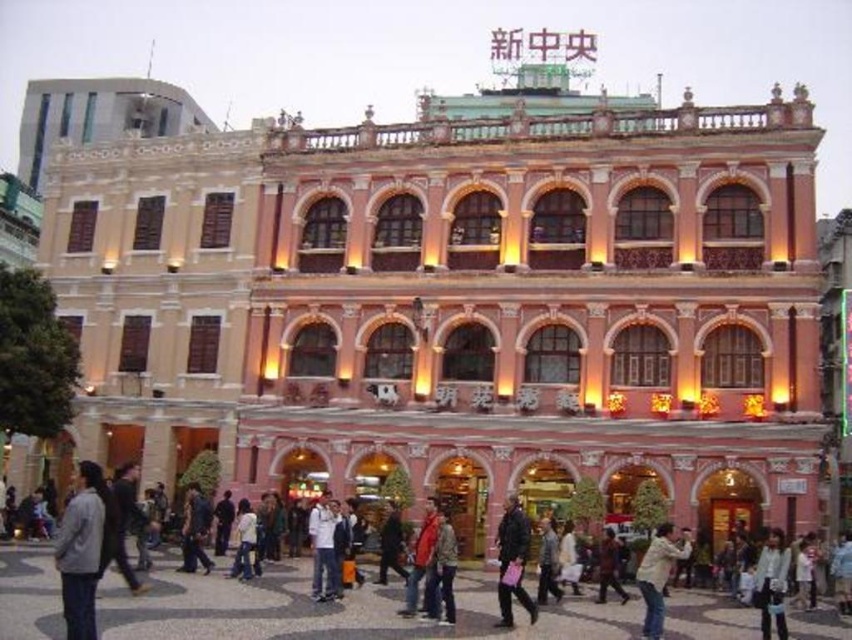
Which is more to the left, dark blue leather jacket at center or brown leather jacket at center?

dark blue leather jacket at center

Does point (531, 614) come farther from viewer compared to point (603, 541)?

No, (531, 614) is in front of (603, 541).

Measure the distance between point (501,554) and camera.

Point (501,554) and camera are 44.06 meters apart from each other.

At what (x,y) coordinates should I click in order to perform the action: click on dark blue leather jacket at center. Please return your answer as a coordinate pair (x, y). Image resolution: width=852 pixels, height=640 pixels. Looking at the image, I should click on (511, 561).

Is point (323, 531) in front of point (608, 545)?

Yes.

Locate an element on the screen. white cotton shirt at center is located at coordinates (323, 547).

This screenshot has width=852, height=640. What do you see at coordinates (81, 550) in the screenshot?
I see `gray fabric jacket at lower left` at bounding box center [81, 550].

Is gray fabric jacket at lower left shorter than dark blue leather jacket at center?

No, gray fabric jacket at lower left is not shorter than dark blue leather jacket at center.

Between point (87, 595) and point (498, 595), which one is positioned behind?

Positioned behind is point (498, 595).

Identify the location of gray fabric jacket at lower left. This screenshot has height=640, width=852. (81, 550).